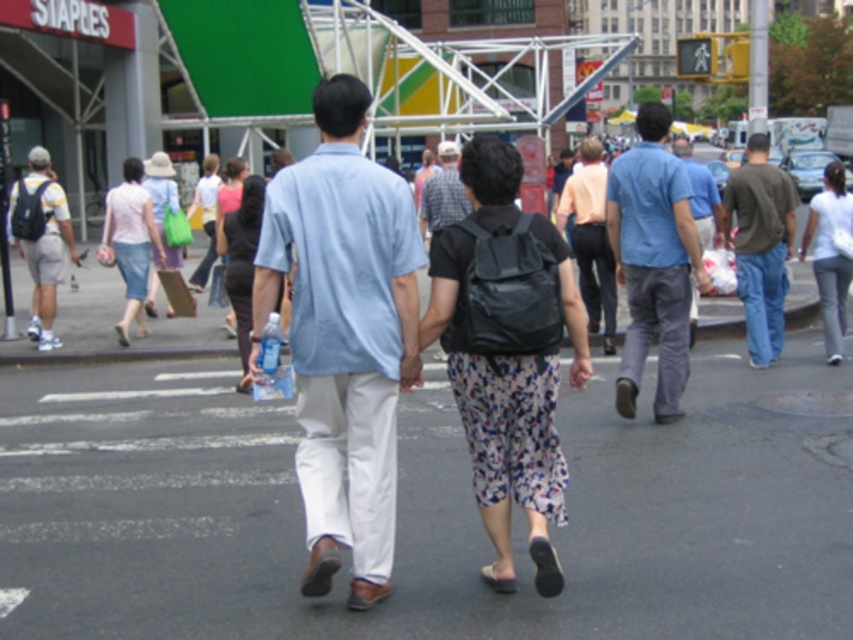
You are a delivery person needing to deliver a package to the light blue cotton shirt at center. You are currently at the point marked by point (343, 336). Which direction should you move to reach the light blue cotton shirt at center?

The point (343, 336) is already on the light blue cotton shirt at center, so you are already at the correct location.

You are a photographer trying to capture a candid shot of the two people walking hand in hand. The light blue cotton shirt at center and the floral skirt at center are your subjects. Since your camera has a limited depth of field, you need to focus on the narrower subject to ensure both are in focus. Which subject should you focus on?

The light blue cotton shirt at center is thinner than the floral skirt at center, so you should focus on the light blue cotton shirt at center to ensure both subjects are in focus.